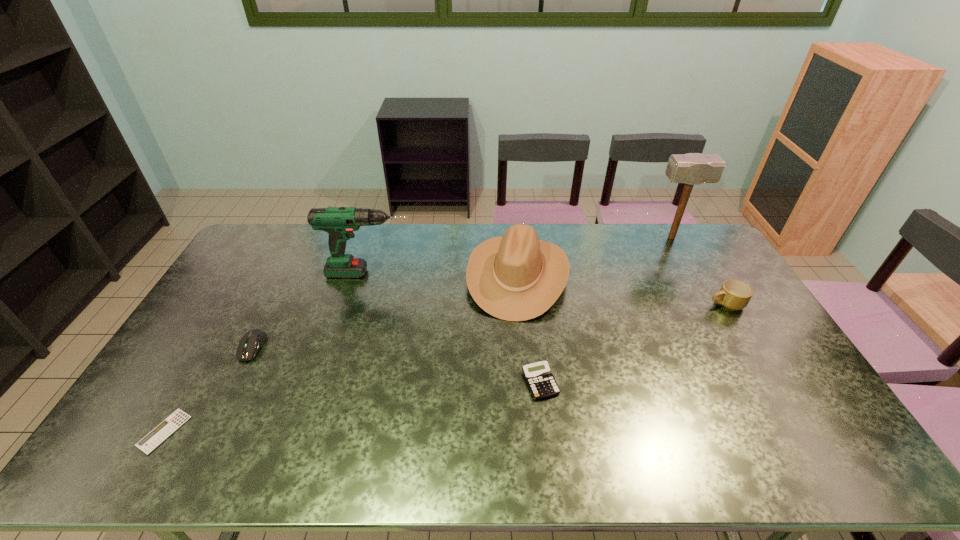
This screenshot has height=540, width=960. In order to click on free space located on the left of the second nearest object in this screenshot , I will do `click(501, 382)`.

Identify the location of vacant space located on the right of the nearer calculator. The image size is (960, 540). (268, 431).

The width and height of the screenshot is (960, 540). I want to click on mallet that is at the far edge, so click(x=692, y=169).

Where is `cowboy hat situated at the far edge`? This screenshot has height=540, width=960. cowboy hat situated at the far edge is located at coordinates (517, 277).

Where is `object positioned at the near edge`? object positioned at the near edge is located at coordinates (167, 427).

This screenshot has width=960, height=540. Identify the location of object that is at the left edge. (167, 427).

Find the location of a particular element. This screenshot has height=540, width=960. mallet situated at the right edge is located at coordinates point(692,169).

Identify the location of mug present at the right edge. The image size is (960, 540). (734, 294).

You are a GUI agent. You are given a task and a screenshot of the screen. Output one action in this format:
    pyautogui.click(x=<x>, y=<y>)
    Task: Click on the object that is at the near left corner
    
    Given the screenshot: What is the action you would take?
    pyautogui.click(x=167, y=427)

Where is `object positioned at the far right corner`? The height and width of the screenshot is (540, 960). object positioned at the far right corner is located at coordinates (692, 169).